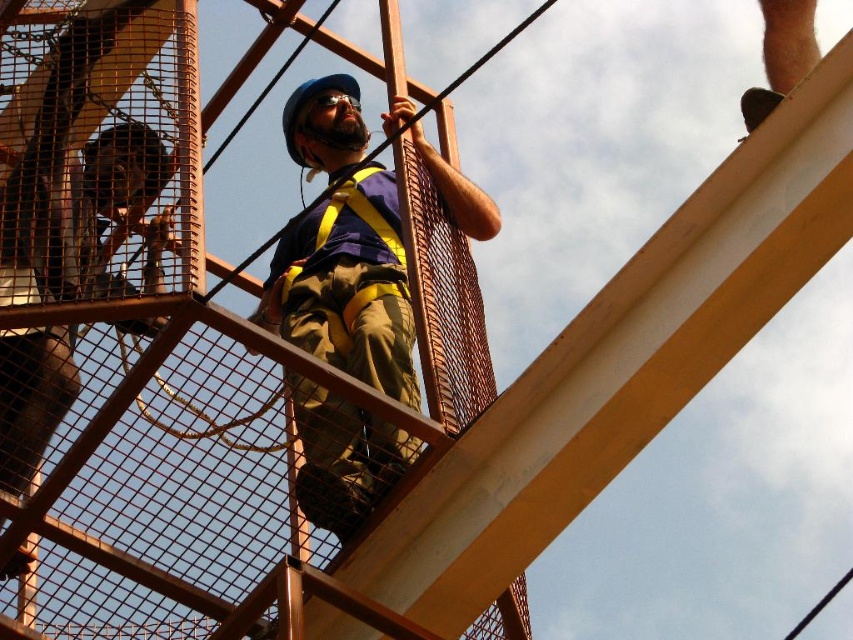
Question: Which of the following is the farthest from the observer?

Choices:
 (A) (341, 509)
 (B) (387, 228)

Answer: (B)

Question: Observing the image, what is the correct spatial positioning of matte blue helmet at center in reference to matte yellow safety vest at center?

Choices:
 (A) left
 (B) right

Answer: (A)

Question: Does matte blue helmet at center have a lesser width compared to matte yellow safety vest at center?

Choices:
 (A) no
 (B) yes

Answer: (A)

Question: Which point is closer to the camera?

Choices:
 (A) matte blue helmet at center
 (B) matte yellow safety vest at center

Answer: (A)

Question: Which of the following is the closest to the observer?

Choices:
 (A) (329, 417)
 (B) (341, 204)

Answer: (A)

Question: Does matte blue helmet at center appear on the left side of matte yellow safety vest at center?

Choices:
 (A) yes
 (B) no

Answer: (A)